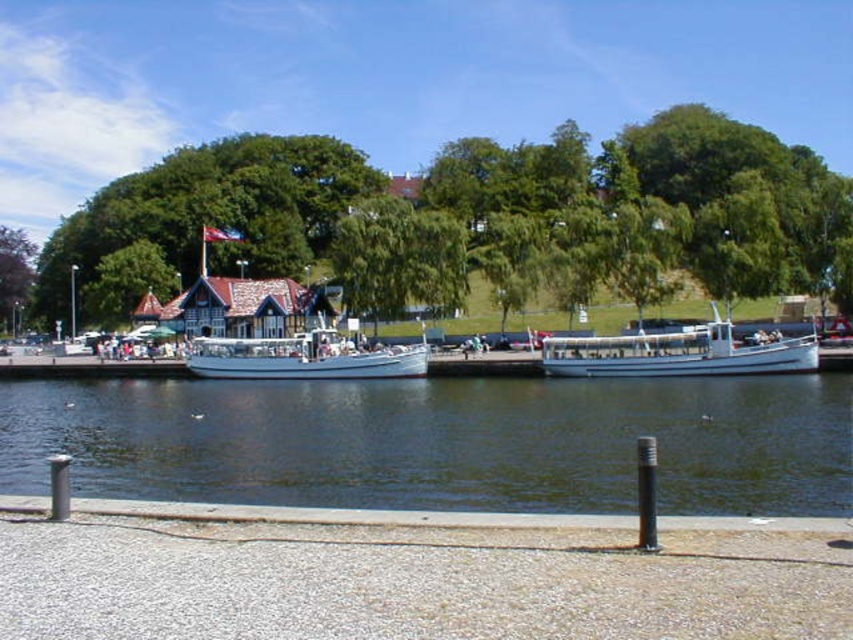
Question: Can you confirm if white matte boat at right is bigger than purple leafy tree at upper left?

Choices:
 (A) yes
 (B) no

Answer: (B)

Question: Which of these objects is positioned farthest from the clear water at lower center?

Choices:
 (A) green leafy tree at upper center
 (B) white matte boat at center
 (C) purple leafy tree at upper left
 (D) white matte boat at right

Answer: (C)

Question: Which point is farther from the camera taking this photo?

Choices:
 (A) (766, 371)
 (B) (45, 268)
 (C) (248, 364)

Answer: (B)

Question: Which point is farther to the camera?

Choices:
 (A) white matte boat at right
 (B) purple leafy tree at upper left
 (C) clear water at lower center
 (D) green leafy tree at upper center

Answer: (B)

Question: Is green leafy tree at upper center bigger than white matte boat at right?

Choices:
 (A) yes
 (B) no

Answer: (A)

Question: Is clear water at lower center closer to the viewer compared to white matte boat at center?

Choices:
 (A) yes
 (B) no

Answer: (A)